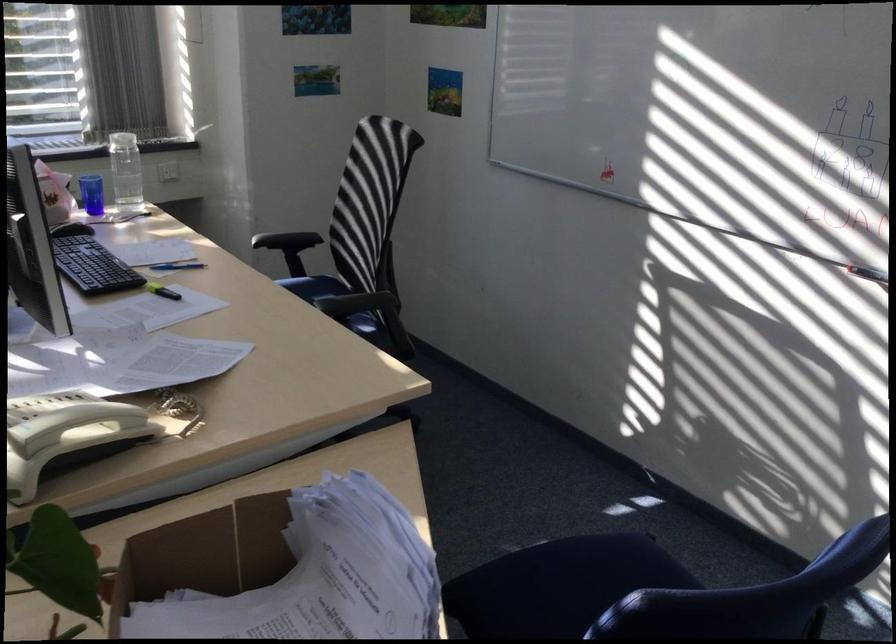
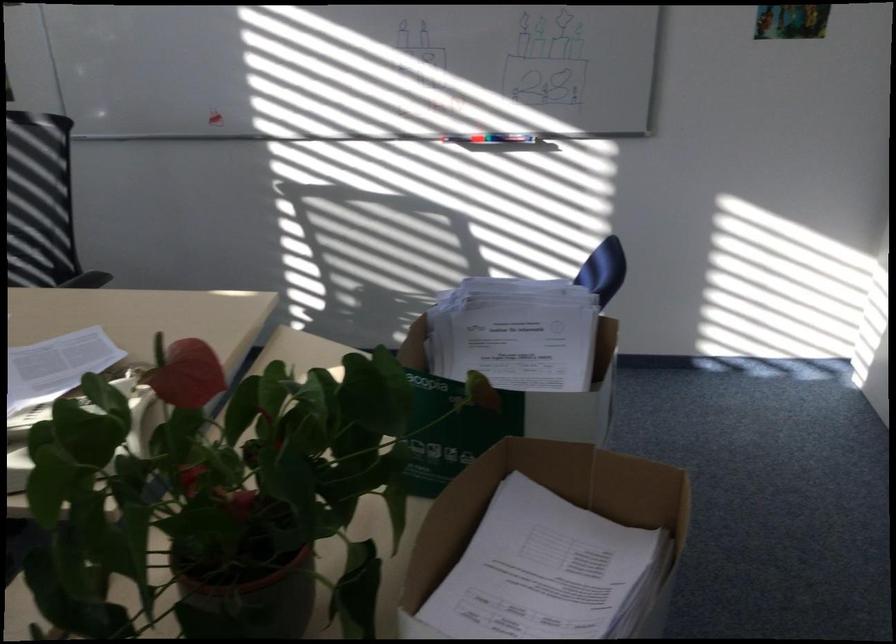
Question: I am providing you with two images of the same scene from different viewpoints. After the viewpoint changes to image2, which objects are now occluded?

Choices:
 (A) white telephone handset
 (B) cardboard box
 (C) orange-top bottle
 (D) brown plant pot

Answer: (A)